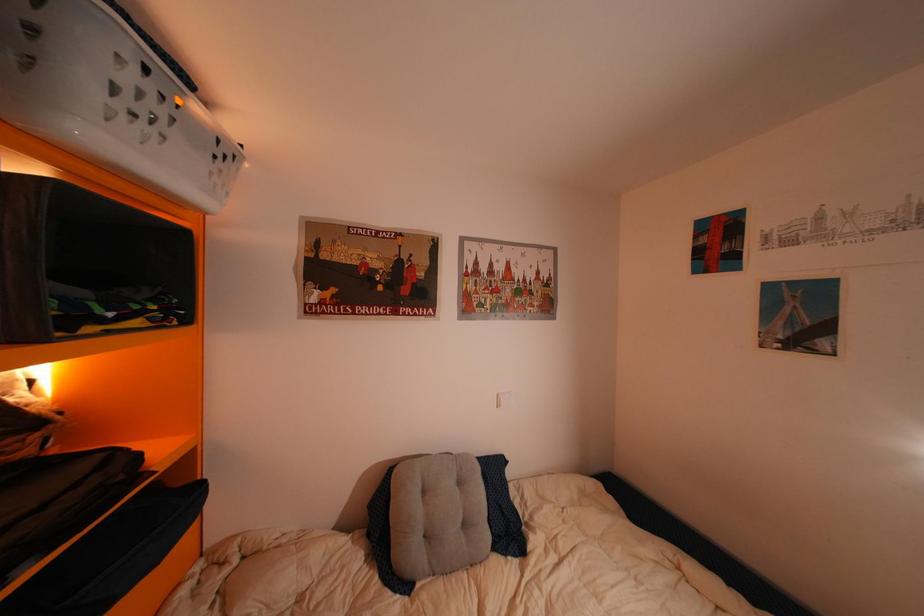
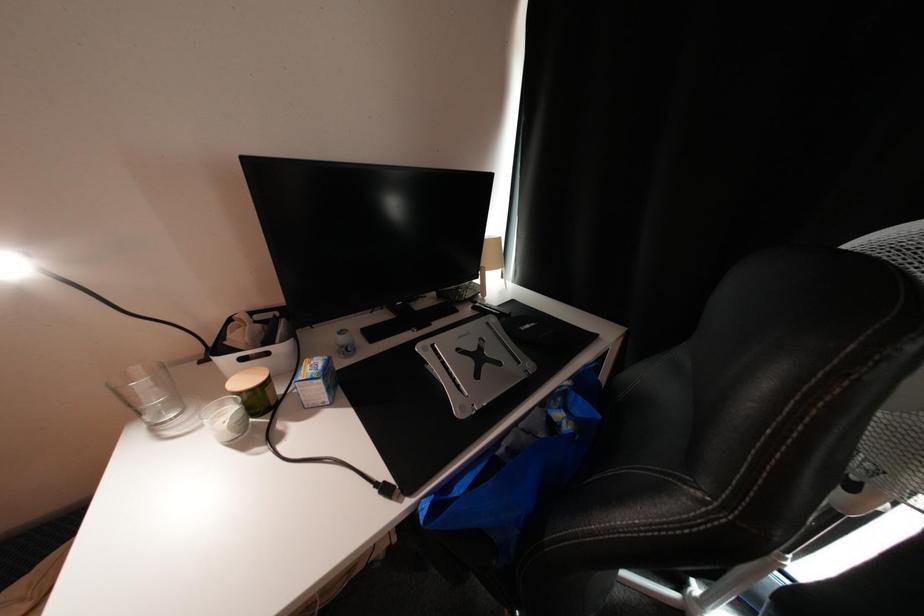
Based on the photo, based on the continuous images, in which direction is the camera rotating?

The camera rotated toward right-down.